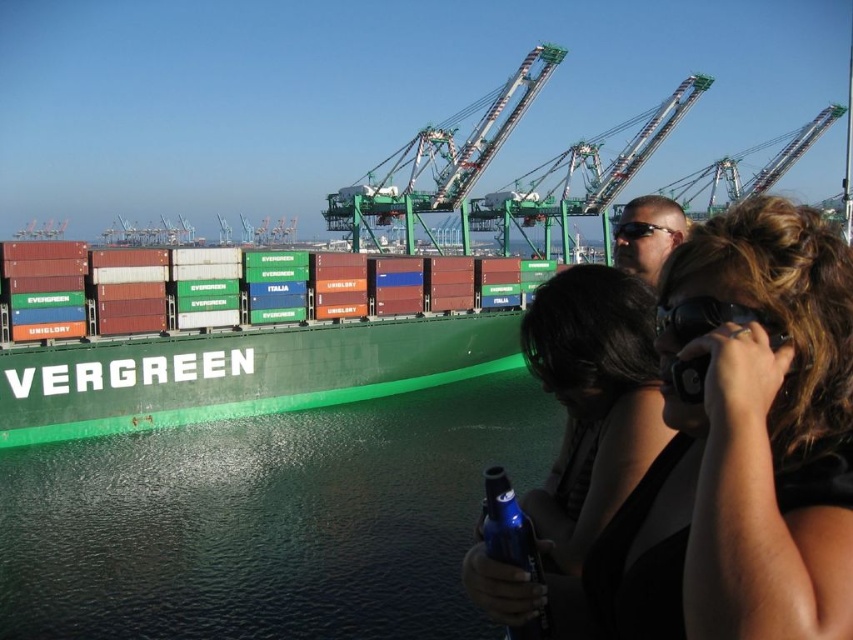
Describe the element at coordinates (729, 452) in the screenshot. I see `matte black sunglasses at center` at that location.

Does matte black sunglasses at center have a larger size compared to matte black hair at center?

Yes.

Who is more forward, (683, 552) or (593, 388)?

Point (683, 552) is more forward.

Find the location of `matte black sunglasses at center`. matte black sunglasses at center is located at coordinates (729, 452).

Between blue glass bottle at lower center and matte black sunglasses at upper center, which one appears on the right side from the viewer's perspective?

From the viewer's perspective, matte black sunglasses at upper center appears more on the right side.

Does point (517, 522) come farther from viewer compared to point (619, 237)?

That is False.

Find the location of `blue glass bottle at lower center`. blue glass bottle at lower center is located at coordinates (508, 525).

Between point (335, 497) and point (509, 545), which one is positioned behind?

Positioned behind is point (335, 497).

Between point (248, 582) and point (540, 577), which one is positioned in front?

Point (540, 577) is in front.

Which is in front, point (251, 552) or point (514, 516)?

Positioned in front is point (514, 516).

Identify the location of green glossy water at lower center. (267, 520).